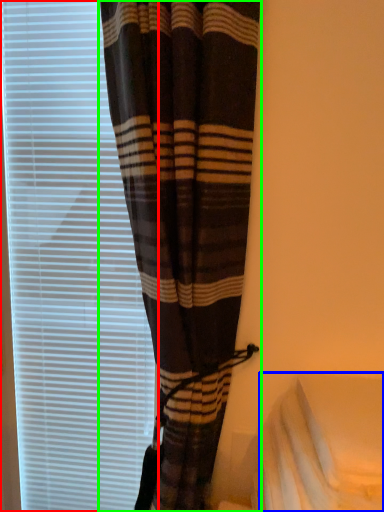
Question: Estimate the real-world distances between objects in this image. Which object is closer to window blind (highlighted by a red box), sheet (highlighted by a blue box) or curtain (highlighted by a green box)?

Choices:
 (A) sheet
 (B) curtain

Answer: (B)